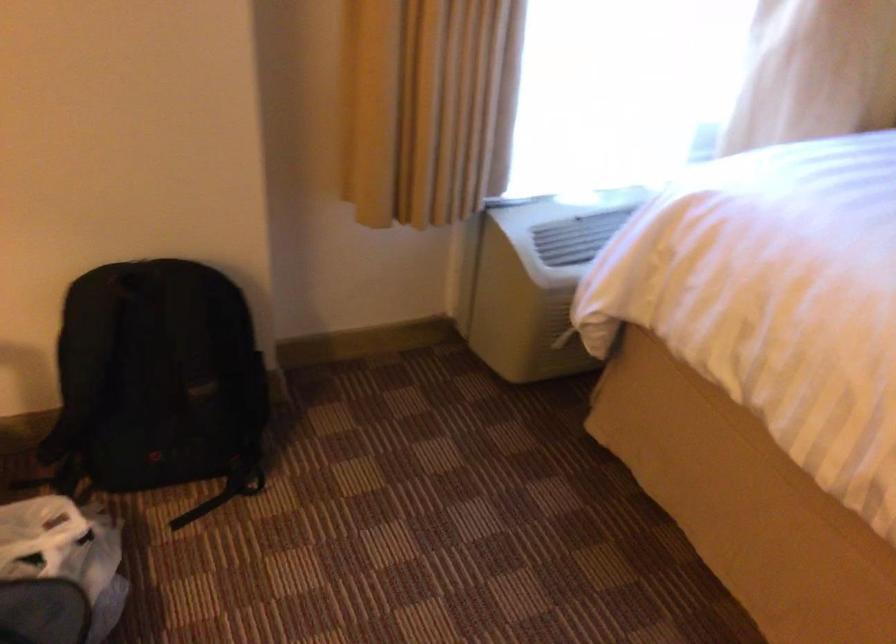
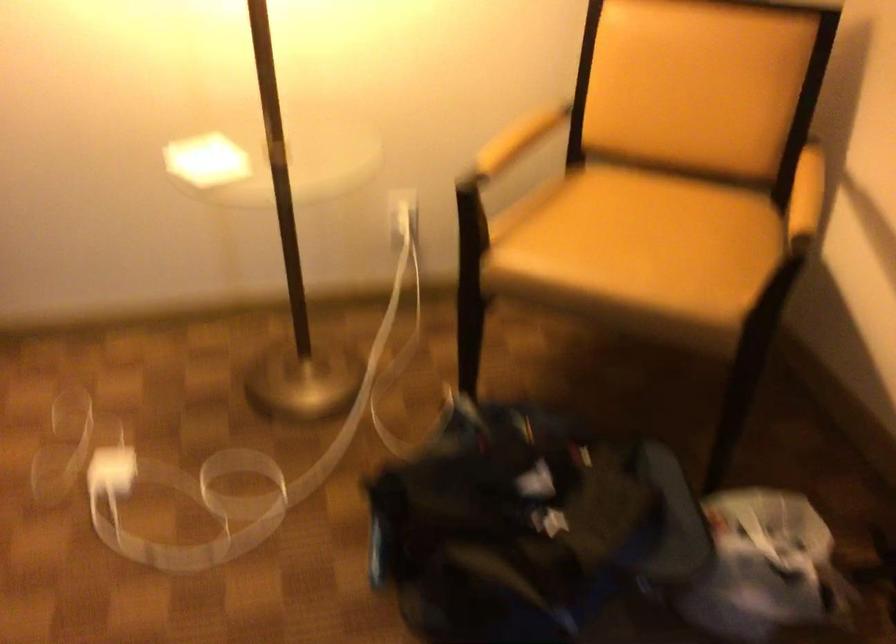
Based on the continuous images, in which direction is the camera rotating?

The camera's rotation is toward left-down.